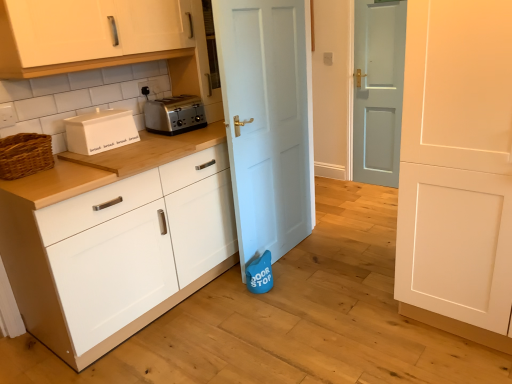
Where is `light blue wooden door at center, which is counted as the third door, starting from the front`? The width and height of the screenshot is (512, 384). light blue wooden door at center, which is counted as the third door, starting from the front is located at coordinates (378, 90).

This screenshot has height=384, width=512. What are the coordinates of `white glossy cabinet at upper left, placed as the second cabinetry when sorted from bottom to top` in the screenshot? It's located at (88, 34).

The height and width of the screenshot is (384, 512). Describe the element at coordinates (174, 115) in the screenshot. I see `satin silver toaster at center` at that location.

The image size is (512, 384). In order to click on light blue wooden door at center, acting as the first door starting from the back in this screenshot , I will do `click(378, 90)`.

From a real-world perspective, who is located lower, light blue wooden door at center, which is counted as the third door, starting from the front, or black plastic electric outlet at upper center?

light blue wooden door at center, which is counted as the third door, starting from the front.

Is light blue wooden door at center, acting as the first door starting from the back, inside the boundaries of black plastic electric outlet at upper center, or outside?

light blue wooden door at center, acting as the first door starting from the back, cannot be found inside black plastic electric outlet at upper center.

Which object is positioned more to the right, light blue wooden door at center, which is counted as the third door, starting from the front, or black plastic electric outlet at upper center?

Positioned to the right is light blue wooden door at center, which is counted as the third door, starting from the front.

Is white matte bread bin at left aimed at light blue matte door at center, acting as the second door starting from the front?

No, white matte bread bin at left does not turn towards light blue matte door at center, acting as the second door starting from the front.

Which is nearer, (83, 132) or (275, 147)?

Point (83, 132) appears to be closer to the viewer than point (275, 147).

Is white matte bread bin at left smaller than light blue matte door at center, acting as the second door starting from the front?

Indeed, white matte bread bin at left has a smaller size compared to light blue matte door at center, acting as the second door starting from the front.

Is white matte bread bin at left further to the viewer compared to light blue matte door at center, the 2th door positioned from the back?

Yes, white matte bread bin at left is further from the camera.

Where is `toaster located above the white matte cabinet at center, which appears as the second cabinetry when viewed from the top (from the image's perspective)`? Image resolution: width=512 pixels, height=384 pixels. toaster located above the white matte cabinet at center, which appears as the second cabinetry when viewed from the top (from the image's perspective) is located at coordinates (174, 115).

How different are the orientations of white matte cabinet at center, the first cabinetry from the bottom, and satin silver toaster at center in degrees?

white matte cabinet at center, the first cabinetry from the bottom, and satin silver toaster at center are facing 2.41 degrees away from each other.

Does point (81, 224) come behind point (153, 102)?

No, (81, 224) is in front of (153, 102).

Is white matte cabinet at center, which appears as the second cabinetry when viewed from the top, placed right next to satin silver toaster at center?

No, white matte cabinet at center, which appears as the second cabinetry when viewed from the top, is not with satin silver toaster at center.

Is white glossy cabinet at upper left, which is counted as the first cabinetry, starting from the top, behind white matte cabinet at center, the first cabinetry from the bottom?

Yes, it is behind white matte cabinet at center, the first cabinetry from the bottom.

Considering the positions of objects white glossy cabinet at upper left, which is counted as the first cabinetry, starting from the top, and white matte cabinet at center, which appears as the second cabinetry when viewed from the top, in the image provided, who is more to the right, white glossy cabinet at upper left, which is counted as the first cabinetry, starting from the top, or white matte cabinet at center, which appears as the second cabinetry when viewed from the top,?

white matte cabinet at center, which appears as the second cabinetry when viewed from the top.

Between white glossy cabinet at upper left, which is counted as the first cabinetry, starting from the top, and white matte cabinet at center, which appears as the second cabinetry when viewed from the top, which one has larger width?

white matte cabinet at center, which appears as the second cabinetry when viewed from the top, is wider.

From the image's perspective, between white glossy cabinet at upper left, which is counted as the first cabinetry, starting from the top, and white matte cabinet at center, which appears as the second cabinetry when viewed from the top, who is located below?

white matte cabinet at center, which appears as the second cabinetry when viewed from the top.

From the image's perspective, is white matte door at right, marked as the third door in a back-to-front arrangement, positioned above or below satin silver toaster at center?

Clearly, from the image's perspective, white matte door at right, marked as the third door in a back-to-front arrangement, is below satin silver toaster at center.

Is white matte door at right, which is the first door from front to back, bigger or smaller than satin silver toaster at center?

white matte door at right, which is the first door from front to back, is bigger than satin silver toaster at center.

Can we say white matte door at right, which is the first door from front to back, lies outside satin silver toaster at center?

Absolutely, white matte door at right, which is the first door from front to back, is external to satin silver toaster at center.

There is a satin silver toaster at center. At what (x,y) coordinates should I click in order to perform the action: click on the 3rd door below it (from a real-world perspective). Please return your answer as a coordinate pair (x, y). This screenshot has width=512, height=384. Looking at the image, I should click on coord(457,169).

Is white matte bread bin at left shorter than white matte cabinet at center, the first cabinetry from the bottom?

Yes.

In terms of width, does white matte bread bin at left look wider or thinner when compared to white matte cabinet at center, which appears as the second cabinetry when viewed from the top?

In the image, white matte bread bin at left appears to be more narrow than white matte cabinet at center, which appears as the second cabinetry when viewed from the top.

Does white matte bread bin at left appear on the right side of white matte cabinet at center, which appears as the second cabinetry when viewed from the top?

No.

Does white matte bread bin at left have a larger size compared to white matte cabinet at center, which appears as the second cabinetry when viewed from the top?

Incorrect, white matte bread bin at left is not larger than white matte cabinet at center, which appears as the second cabinetry when viewed from the top.

From a real-world perspective, starting from the light blue matte door at center, acting as the second door starting from the front, which door is the 2nd one below it? Please provide its 2D coordinates.

[(457, 169)]

Is point (463, 326) positioned in front of point (305, 181)?

Yes, it is.

Is white matte door at right, which is the first door from front to back, oriented away from light blue matte door at center, the 2th door positioned from the back?

white matte door at right, which is the first door from front to back, is not turned away from light blue matte door at center, the 2th door positioned from the back.

Considering the relative sizes of white matte door at right, which is the first door from front to back, and light blue matte door at center, the 2th door positioned from the back, in the image provided, is white matte door at right, which is the first door from front to back, bigger than light blue matte door at center, the 2th door positioned from the back,?

Yes.

Starting from the black plastic electric outlet at upper center, which door is the 3rd one to the right? Please provide its 2D coordinates.

[(378, 90)]

Find the location of a particular element. Image resolution: width=512 pixels, height=384 pixels. the 1st door located beneath the white matte bread bin at left (from a real-world perspective) is located at coordinates (266, 121).

Considering their positions, is black plastic electric outlet at upper center positioned further to light blue wooden door at center, which is counted as the third door, starting from the front, than satin silver toaster at center?

Among the two, black plastic electric outlet at upper center is located further to light blue wooden door at center, which is counted as the third door, starting from the front.

Looking at the image, which one is located further to light blue matte door at center, acting as the second door starting from the front, black plastic electric outlet at upper center or woven brown basket at left?

Based on the image, woven brown basket at left appears to be further to light blue matte door at center, acting as the second door starting from the front.

Which object lies further to the anchor point white matte bread bin at left, light blue matte door at center, acting as the second door starting from the front, or light blue wooden door at center, acting as the first door starting from the back?

light blue wooden door at center, acting as the first door starting from the back, is positioned further to the anchor white matte bread bin at left.

Considering their positions, is light blue wooden door at center, acting as the first door starting from the back, positioned further to black plastic electric outlet at upper center than white matte cabinet at center, the first cabinetry from the bottom?

Based on the image, light blue wooden door at center, acting as the first door starting from the back, appears to be further to black plastic electric outlet at upper center.

From the image, which object appears to be farther from satin silver toaster at center, white matte cabinet at center, the first cabinetry from the bottom, or light blue matte door at center, acting as the second door starting from the front?

white matte cabinet at center, the first cabinetry from the bottom, is further to satin silver toaster at center.

When comparing their distances from white matte cabinet at center, the first cabinetry from the bottom, does woven brown basket at left or white glossy cabinet at upper left, placed as the second cabinetry when sorted from bottom to top, seem closer?

Based on the image, woven brown basket at left appears to be nearer to white matte cabinet at center, the first cabinetry from the bottom.

Based on their spatial positions, is white matte door at right, marked as the third door in a back-to-front arrangement, or black plastic electric outlet at upper center further from white matte bread bin at left?

white matte door at right, marked as the third door in a back-to-front arrangement, is further to white matte bread bin at left.

Considering their positions, is light blue matte door at center, the 2th door positioned from the back, positioned closer to black plastic electric outlet at upper center than white matte door at right, which is the first door from front to back?

light blue matte door at center, the 2th door positioned from the back, lies closer to black plastic electric outlet at upper center than the other object.

Image resolution: width=512 pixels, height=384 pixels. What are the coordinates of `home appliance between woven brown basket at left and white matte cabinet at center, the first cabinetry from the bottom, from left to right` in the screenshot? It's located at (100, 131).

Locate an element on the screen. The height and width of the screenshot is (384, 512). toaster positioned between white matte cabinet at center, the first cabinetry from the bottom, and black plastic electric outlet at upper center from near to far is located at coordinates (174, 115).

The height and width of the screenshot is (384, 512). Identify the location of door between white matte door at right, which is the first door from front to back, and light blue wooden door at center, acting as the first door starting from the back, along the z-axis. (266, 121).

What are the coordinates of `toaster between white matte bread bin at left and light blue wooden door at center, acting as the first door starting from the back, from left to right` in the screenshot? It's located at (174, 115).